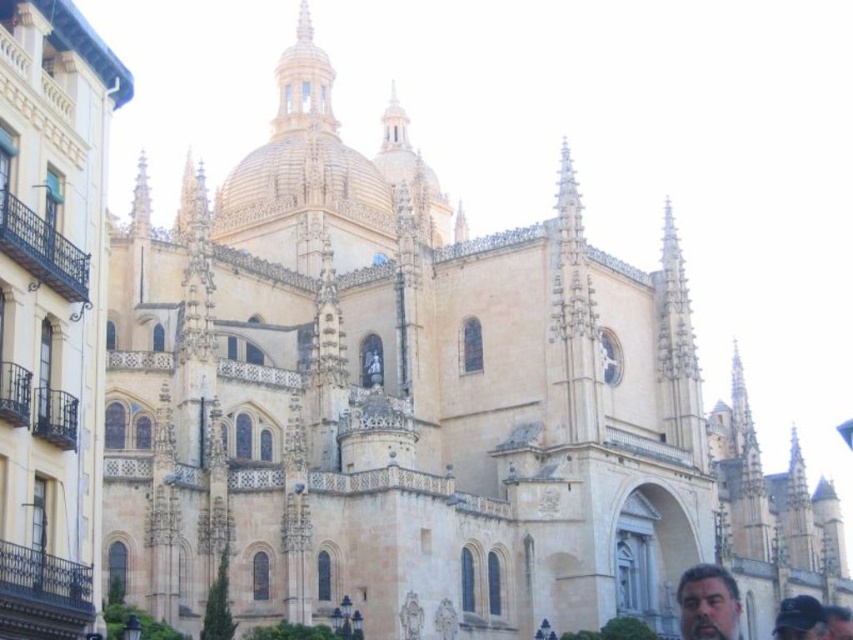
Question: Is dark brown hair at lower right to the left of dark blue fabric cap at lower right from the viewer's perspective?

Choices:
 (A) yes
 (B) no

Answer: (A)

Question: Which object appears closest to the camera in this image?

Choices:
 (A) dark blue fabric cap at lower right
 (B) dark brown leather cap at lower right
 (C) dark brown hair at lower right

Answer: (C)

Question: Which object is the closest to the dark brown hair at lower right?

Choices:
 (A) dark brown leather cap at lower right
 (B) dark blue fabric cap at lower right

Answer: (B)

Question: Can you confirm if dark blue fabric cap at lower right is positioned below dark brown leather cap at lower right?

Choices:
 (A) no
 (B) yes

Answer: (A)

Question: Among these points, which one is nearest to the camera?

Choices:
 (A) (695, 612)
 (B) (842, 637)
 (C) (817, 627)

Answer: (B)

Question: Can you confirm if dark brown hair at lower right is positioned below dark blue fabric cap at lower right?

Choices:
 (A) yes
 (B) no

Answer: (B)